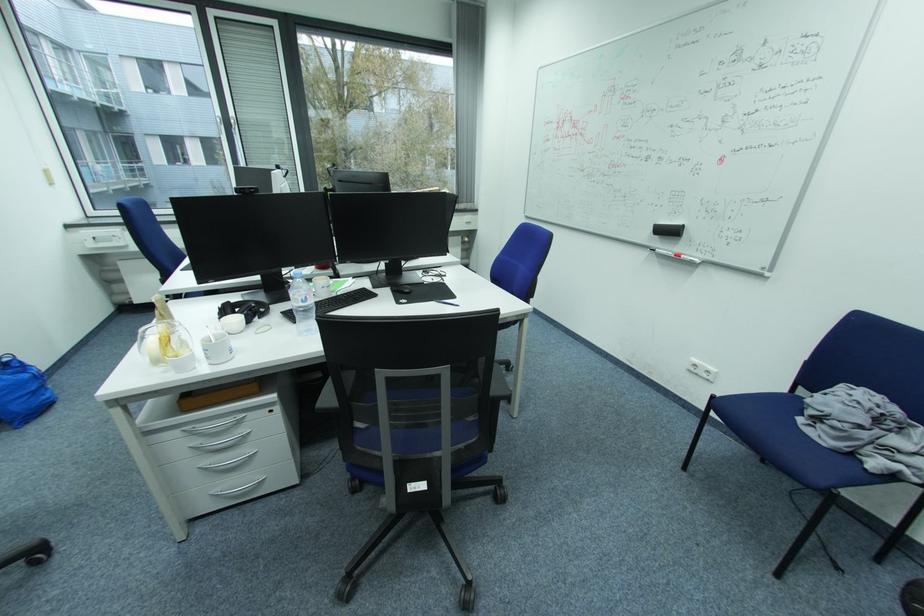
Image resolution: width=924 pixels, height=616 pixels. Find the location of `white mug handle`. white mug handle is located at coordinates (210, 336).